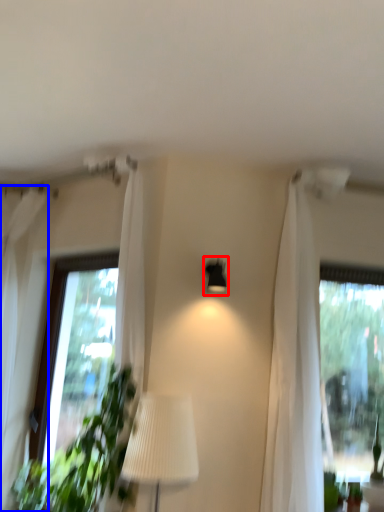
Question: Among these objects, which one is farthest to the camera, lamp (highlighted by a red box) or curtain (highlighted by a blue box)?

Choices:
 (A) lamp
 (B) curtain

Answer: (A)